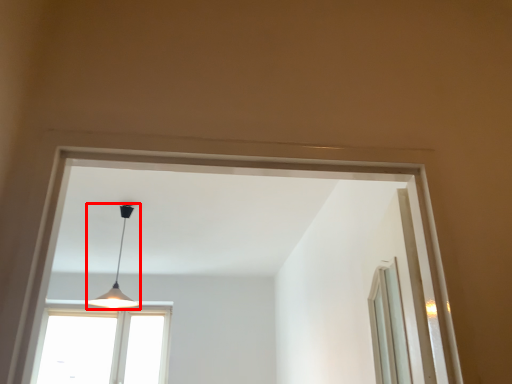
Question: Observing the image, what is the correct spatial positioning of lamp (annotated by the red box) in reference to window?

Choices:
 (A) left
 (B) right

Answer: (B)